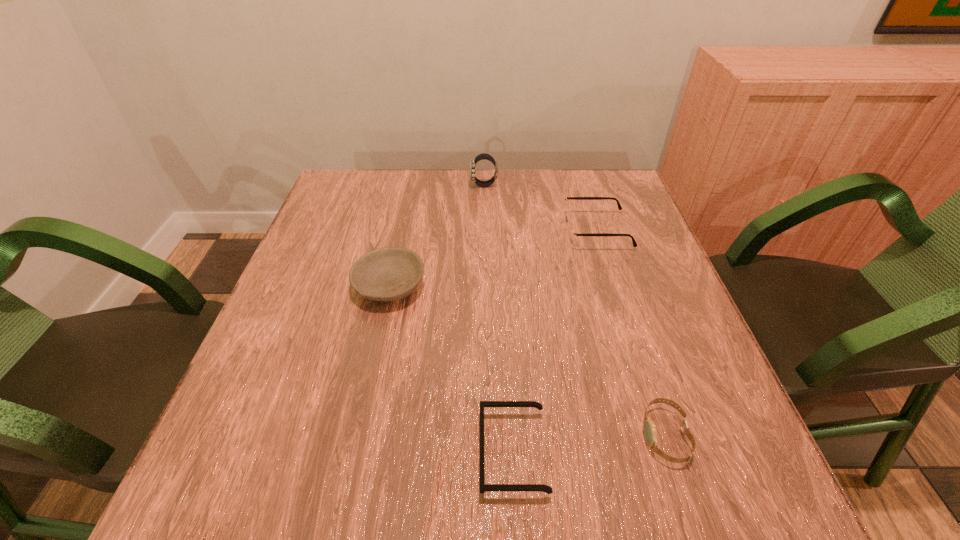
I want to click on vacant space at the far edge of the desktop, so click(x=428, y=193).

Where is `vacant area at the near edge of the desktop`? This screenshot has height=540, width=960. vacant area at the near edge of the desktop is located at coordinates (564, 472).

The image size is (960, 540). In the image, there is a desktop. Identify the location of vacant area at the left edge. (317, 230).

The height and width of the screenshot is (540, 960). Identify the location of vacant space at the right edge of the desktop. (638, 329).

In the image, there is a desktop. At what (x,y) coordinates should I click in order to perform the action: click on vacant space at the far left corner. Please return your answer as a coordinate pair (x, y). Looking at the image, I should click on (344, 211).

Find the location of `vacant space at the near left corner of the desktop`. vacant space at the near left corner of the desktop is located at coordinates (282, 466).

In the image, there is a desktop. Where is `vacant region at the far right corner`? vacant region at the far right corner is located at coordinates (599, 203).

In the image, there is a desktop. Where is `vacant space at the near right corner`? The height and width of the screenshot is (540, 960). vacant space at the near right corner is located at coordinates (755, 497).

Identify the location of free spot between the spectacles and the right watch. The image size is (960, 540). (631, 333).

Locate an element on the screen. This screenshot has height=540, width=960. empty location between the nearer watch and the farther watch is located at coordinates (574, 310).